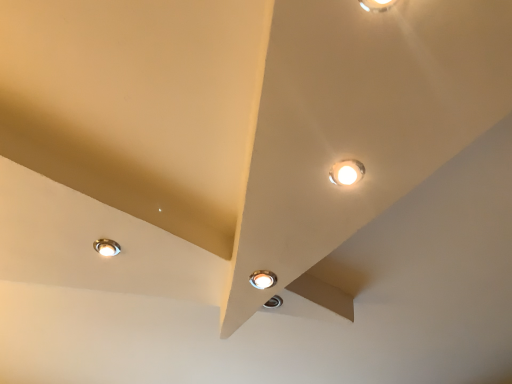
Question: Which is correct: matte white lamp at upper right, arranged as the 1th lamp when viewed from the top, is inside matte silver lamp at center, the 3th lamp viewed from the top, or outside of it?

Choices:
 (A) outside
 (B) inside

Answer: (A)

Question: Based on their sizes in the image, would you say matte white lamp at upper right, the 3th lamp when ordered from left to right, is bigger or smaller than matte silver lamp at center, positioned as the second lamp in left-to-right order?

Choices:
 (A) big
 (B) small

Answer: (A)

Question: Considering the real-world distances, which object is closest to the matte silver lamp at lower left, which appears as the first lamp when viewed from the back?

Choices:
 (A) matte silver lamp at center, acting as the second lamp starting from the front
 (B) matte white lamp at upper right, arranged as the 1th lamp when viewed from the top

Answer: (A)

Question: Based on their relative distances, which object is farther from the matte silver lamp at center, the 3th lamp viewed from the top?

Choices:
 (A) matte white lamp at upper right, arranged as the third lamp when viewed from the back
 (B) matte silver lamp at lower left, which is the 1th lamp from left to right

Answer: (B)